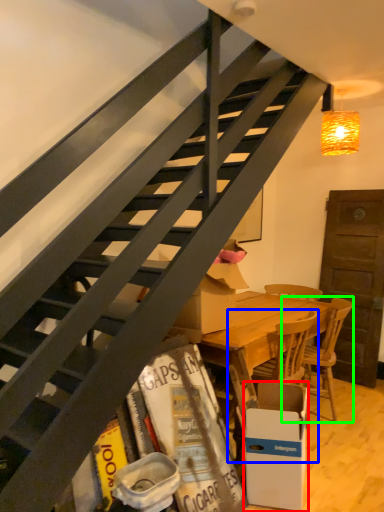
Question: Estimate the real-world distances between objects in this image. Which object is farther from box (highlighted by a red box), chair (highlighted by a blue box) or chair (highlighted by a green box)?

Choices:
 (A) chair
 (B) chair

Answer: (B)